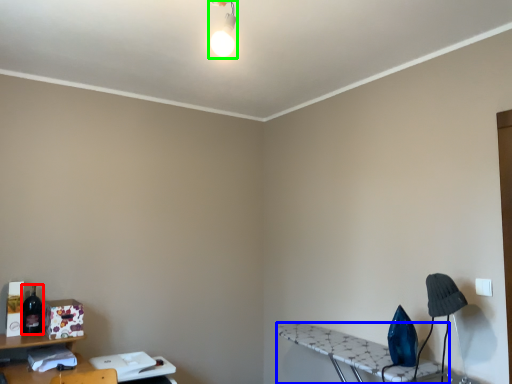
Question: Based on their relative distances, which object is nearer to bottle (highlighted by a red box)? Choose from table (highlighted by a blue box) and light fixture (highlighted by a green box).

Choices:
 (A) table
 (B) light fixture

Answer: (A)